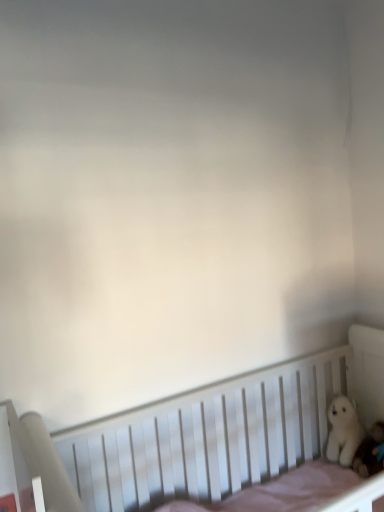
Question: Is white wooden crib at lower right taller than white plush bear at right, acting as the second toy starting from the front?

Choices:
 (A) yes
 (B) no

Answer: (A)

Question: From a real-world perspective, is white wooden crib at lower right beneath white plush bear at right, positioned as the first toy in back-to-front order?

Choices:
 (A) no
 (B) yes

Answer: (B)

Question: Is white wooden crib at lower right outside of white plush bear at right, positioned as the first toy in back-to-front order?

Choices:
 (A) yes
 (B) no

Answer: (A)

Question: Does white wooden crib at lower right have a lesser width compared to white plush bear at right, acting as the second toy starting from the front?

Choices:
 (A) no
 (B) yes

Answer: (A)

Question: Is white wooden crib at lower right behind white plush bear at right, positioned as the first toy in back-to-front order?

Choices:
 (A) yes
 (B) no

Answer: (B)

Question: From a real-world perspective, is white wooden crib at lower right located higher than white plush bear at right, acting as the second toy starting from the front?

Choices:
 (A) yes
 (B) no

Answer: (B)

Question: Is white wooden crib at lower right surrounded by white plush bear at right, acting as the second toy starting from the front?

Choices:
 (A) no
 (B) yes

Answer: (A)

Question: Is white plush bear at right, acting as the second toy starting from the front, behind white wooden crib at lower right?

Choices:
 (A) yes
 (B) no

Answer: (A)

Question: From the image's perspective, is white plush bear at right, positioned as the first toy in back-to-front order, located beneath white wooden crib at lower right?

Choices:
 (A) yes
 (B) no

Answer: (B)

Question: Considering the relative sizes of white plush bear at right, positioned as the first toy in back-to-front order, and white wooden crib at lower right in the image provided, is white plush bear at right, positioned as the first toy in back-to-front order, taller than white wooden crib at lower right?

Choices:
 (A) yes
 (B) no

Answer: (B)

Question: From a real-world perspective, is white plush bear at right, acting as the second toy starting from the front, located higher than white wooden crib at lower right?

Choices:
 (A) yes
 (B) no

Answer: (A)

Question: Does white plush bear at right, positioned as the first toy in back-to-front order, have a greater width compared to white wooden crib at lower right?

Choices:
 (A) no
 (B) yes

Answer: (A)

Question: Is white plush toy at lower right, acting as the second toy starting from the back, not inside white plush bear at right, acting as the second toy starting from the front?

Choices:
 (A) no
 (B) yes

Answer: (B)